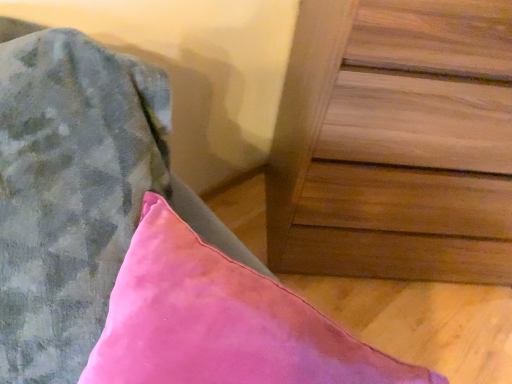
The height and width of the screenshot is (384, 512). What do you see at coordinates (395, 142) in the screenshot? I see `wooden chest of drawers at center` at bounding box center [395, 142].

In order to face wooden chest of drawers at center, should I rotate leftwards or rightwards?

A 23.968 degree turn to the right will do.

Locate an element on the screen. The height and width of the screenshot is (384, 512). wooden chest of drawers at center is located at coordinates (395, 142).

Measure the distance between point (454,167) and camera.

They are 35.00 inches apart.

The width and height of the screenshot is (512, 384). I want to click on wooden chest of drawers at center, so click(x=395, y=142).